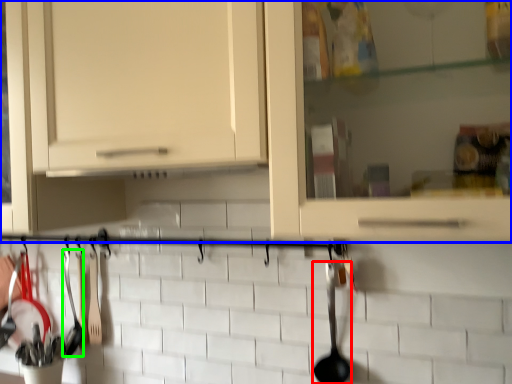
Question: Which is nearer to the silverware (highlighted by a red box)? cabinetry (highlighted by a blue box) or silverware (highlighted by a green box).

Choices:
 (A) cabinetry
 (B) silverware

Answer: (A)